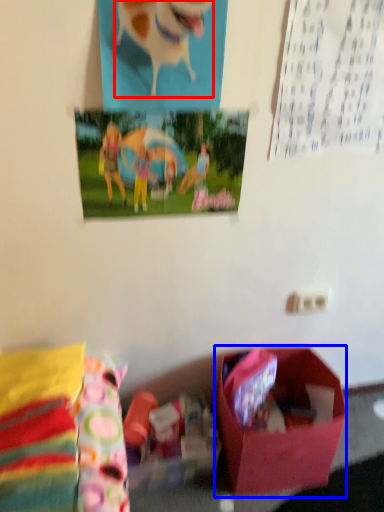
Question: Which point is further to the camera, animal (highlighted by a red box) or box (highlighted by a blue box)?

Choices:
 (A) animal
 (B) box

Answer: (B)